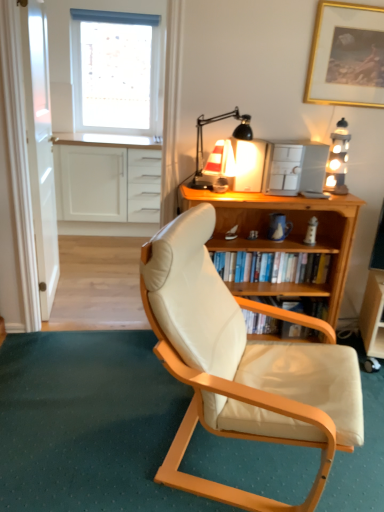
Question: Can you confirm if wooden bookshelf at center is wider than wooden bookshelf at center?

Choices:
 (A) no
 (B) yes

Answer: (B)

Question: Does wooden bookshelf at center touch wooden bookshelf at center?

Choices:
 (A) no
 (B) yes

Answer: (A)

Question: From the image's perspective, would you say wooden bookshelf at center is positioned over wooden bookshelf at center?

Choices:
 (A) yes
 (B) no

Answer: (B)

Question: Is wooden bookshelf at center taller than wooden bookshelf at center?

Choices:
 (A) yes
 (B) no

Answer: (A)

Question: Is wooden bookshelf at center at the back of wooden bookshelf at center?

Choices:
 (A) yes
 (B) no

Answer: (A)

Question: Considering their positions, is white leather chair at center located in front of or behind transparent glass door at left?

Choices:
 (A) front
 (B) behind

Answer: (A)

Question: In terms of height, does white leather chair at center look taller or shorter compared to transparent glass door at left?

Choices:
 (A) tall
 (B) short

Answer: (B)

Question: Considering the positions of white leather chair at center and transparent glass door at left in the image, is white leather chair at center wider or thinner than transparent glass door at left?

Choices:
 (A) thin
 (B) wide

Answer: (B)

Question: Is point (96, 366) closer or farther from the camera than point (54, 257)?

Choices:
 (A) farther
 (B) closer

Answer: (B)

Question: Is wooden bookshelf at center taller or shorter than gold-framed picture at upper right?

Choices:
 (A) short
 (B) tall

Answer: (A)

Question: Considering the relative positions of wooden bookshelf at center and gold-framed picture at upper right in the image provided, is wooden bookshelf at center to the left or to the right of gold-framed picture at upper right?

Choices:
 (A) right
 (B) left

Answer: (B)

Question: From a real-world perspective, relative to gold-framed picture at upper right, is wooden bookshelf at center vertically above or below?

Choices:
 (A) above
 (B) below

Answer: (B)

Question: From the image's perspective, is wooden bookshelf at center positioned above or below gold-framed picture at upper right?

Choices:
 (A) below
 (B) above

Answer: (A)

Question: From the image's perspective, relative to gold-framed picture at upper right, is wooden bookshelf at center above or below?

Choices:
 (A) above
 (B) below

Answer: (B)

Question: From a real-world perspective, is wooden bookshelf at center physically located above or below gold-framed picture at upper right?

Choices:
 (A) below
 (B) above

Answer: (A)